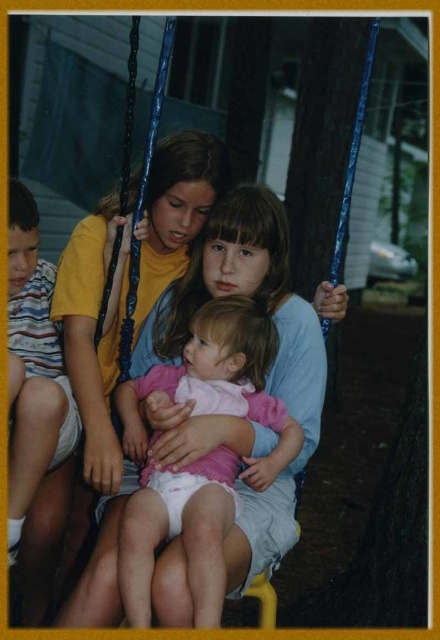
Who is positioned more to the left, matte pink dress at center or striped cotton shirt at left?

striped cotton shirt at left

Is matte pink dress at center positioned before striped cotton shirt at left?

Yes, it is in front of striped cotton shirt at left.

Between point (252, 465) and point (41, 465), which one is positioned behind?

The point (41, 465) is more distant.

This screenshot has width=440, height=640. I want to click on matte pink dress at center, so click(223, 380).

Does matte blue swing at center have a greater height compared to striped cotton shirt at left?

Correct, matte blue swing at center is much taller as striped cotton shirt at left.

Between matte blue swing at center and striped cotton shirt at left, which one appears on the left side from the viewer's perspective?

striped cotton shirt at left

What do you see at coordinates (275, 358) in the screenshot? I see `matte blue swing at center` at bounding box center [275, 358].

Find the location of a particular element. The width and height of the screenshot is (440, 640). matte blue swing at center is located at coordinates (275, 358).

Does matte blue swing at center have a greater width compared to matte pink dress at center?

Correct, the width of matte blue swing at center exceeds that of matte pink dress at center.

Does matte blue swing at center appear under matte pink dress at center?

Incorrect, matte blue swing at center is not positioned below matte pink dress at center.

The image size is (440, 640). What do you see at coordinates (275, 358) in the screenshot?
I see `matte blue swing at center` at bounding box center [275, 358].

Identify the location of matte blue swing at center. The height and width of the screenshot is (640, 440). (275, 358).